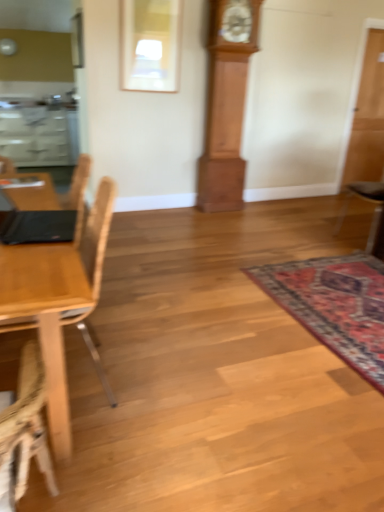
Question: Is carpeted rug at lower right closer to the viewer compared to black leather chair at right, the second chair from the left?

Choices:
 (A) no
 (B) yes

Answer: (B)

Question: Does carpeted rug at lower right appear on the left side of black leather chair at right, which ranks as the first chair in back-to-front order?

Choices:
 (A) no
 (B) yes

Answer: (B)

Question: Is black leather chair at right, marked as the 2th chair in a front-to-back arrangement, at the back of carpeted rug at lower right?

Choices:
 (A) yes
 (B) no

Answer: (B)

Question: Can you confirm if carpeted rug at lower right is wider than black leather chair at right, the second chair from the left?

Choices:
 (A) yes
 (B) no

Answer: (A)

Question: From a real-world perspective, is carpeted rug at lower right located higher than black leather chair at right, marked as the 2th chair in a front-to-back arrangement?

Choices:
 (A) no
 (B) yes

Answer: (A)

Question: Based on their sizes in the image, would you say transparent glass door at right is bigger or smaller than carpeted rug at lower right?

Choices:
 (A) small
 (B) big

Answer: (B)

Question: Is transparent glass door at right in front of or behind carpeted rug at lower right in the image?

Choices:
 (A) behind
 (B) front

Answer: (A)

Question: Is point (365, 141) closer or farther from the camera than point (357, 322)?

Choices:
 (A) farther
 (B) closer

Answer: (A)

Question: Looking at their shapes, would you say transparent glass door at right is wider or thinner than carpeted rug at lower right?

Choices:
 (A) thin
 (B) wide

Answer: (A)

Question: Is light wood chair at left, which is counted as the second chair, starting from the right, wider or thinner than wooden grandfather clock at center?

Choices:
 (A) thin
 (B) wide

Answer: (B)

Question: Would you say light wood chair at left, the 1th chair from the left, is inside or outside wooden grandfather clock at center?

Choices:
 (A) outside
 (B) inside

Answer: (A)

Question: Considering their positions, is light wood chair at left, which is counted as the second chair, starting from the right, located in front of or behind wooden grandfather clock at center?

Choices:
 (A) front
 (B) behind

Answer: (A)

Question: Considering the positions of light wood chair at left, the 1th chair from the left, and wooden grandfather clock at center in the image, is light wood chair at left, the 1th chair from the left, bigger or smaller than wooden grandfather clock at center?

Choices:
 (A) big
 (B) small

Answer: (B)

Question: From their relative heights in the image, would you say carpeted rug at lower right is taller or shorter than transparent glass door at right?

Choices:
 (A) short
 (B) tall

Answer: (A)

Question: Considering the positions of carpeted rug at lower right and transparent glass door at right in the image, is carpeted rug at lower right bigger or smaller than transparent glass door at right?

Choices:
 (A) small
 (B) big

Answer: (A)